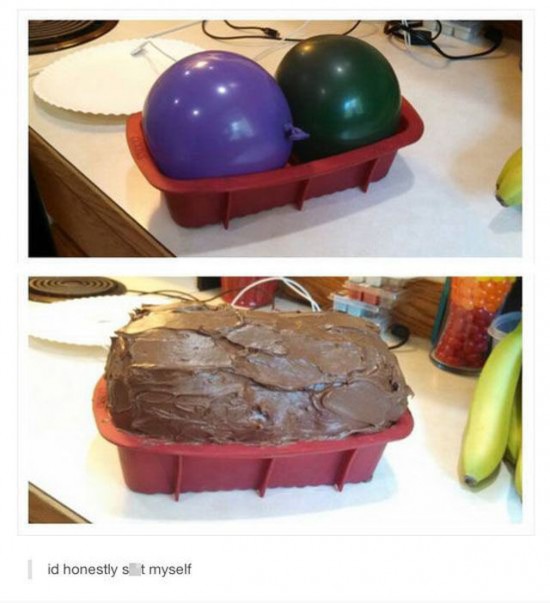
The width and height of the screenshot is (550, 603). What are the coordinates of `surface` in the screenshot? It's located at (412, 497).